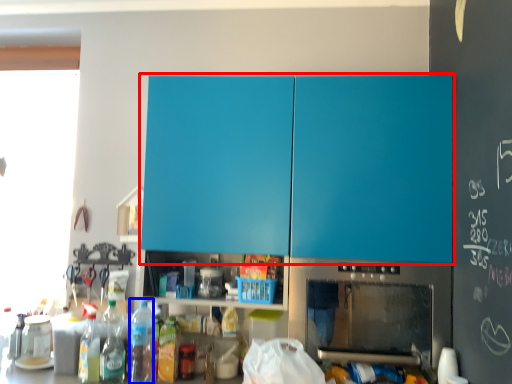
Question: Which point is further to the camera, cabinetry (highlighted by a red box) or bottle (highlighted by a blue box)?

Choices:
 (A) cabinetry
 (B) bottle

Answer: (B)